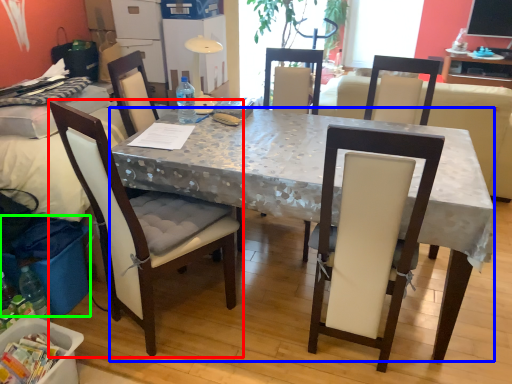
Question: Which is nearer to the chair (highlighted by a red box)? desk (highlighted by a blue box) or trash bin/can (highlighted by a green box).

Choices:
 (A) desk
 (B) trash bin/can

Answer: (B)